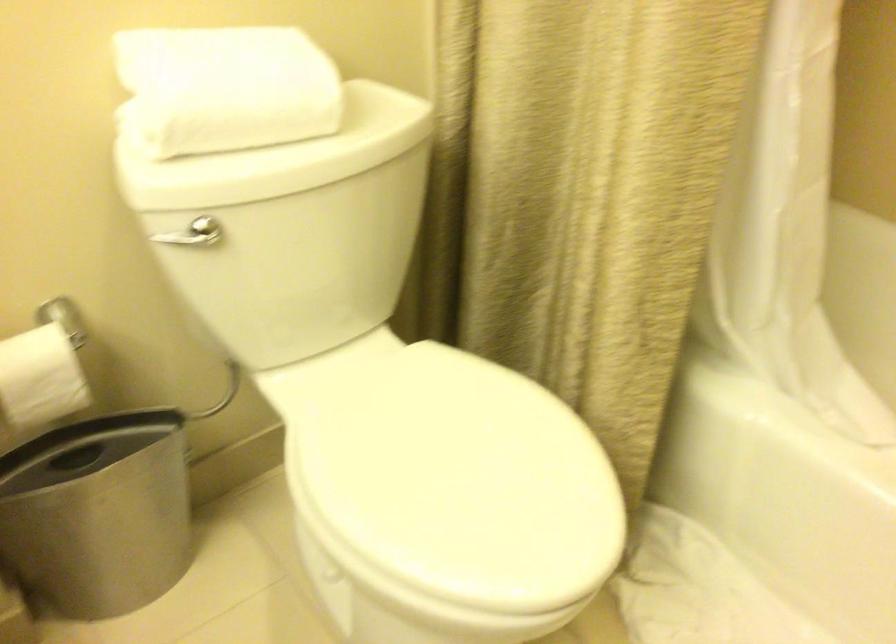
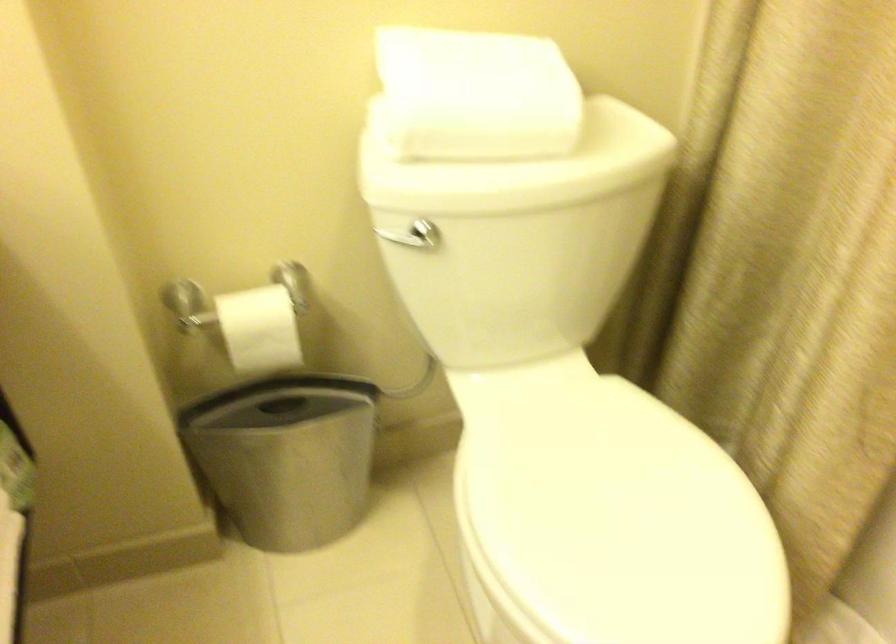
Question: The images are taken continuously from a first-person perspective. In which direction is your viewpoint rotating?

Choices:
 (A) Left
 (B) Right
 (C) Up
 (D) Down

Answer: (A)